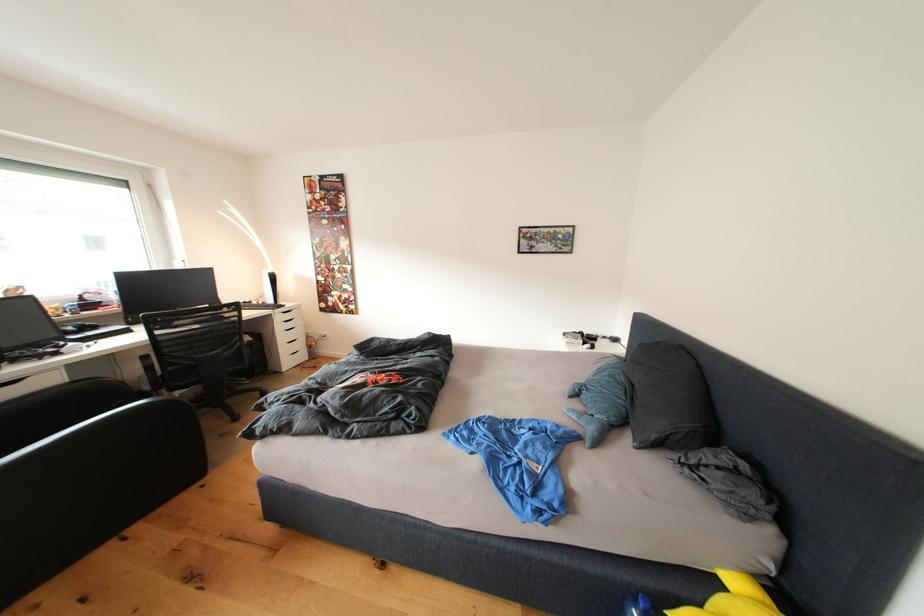
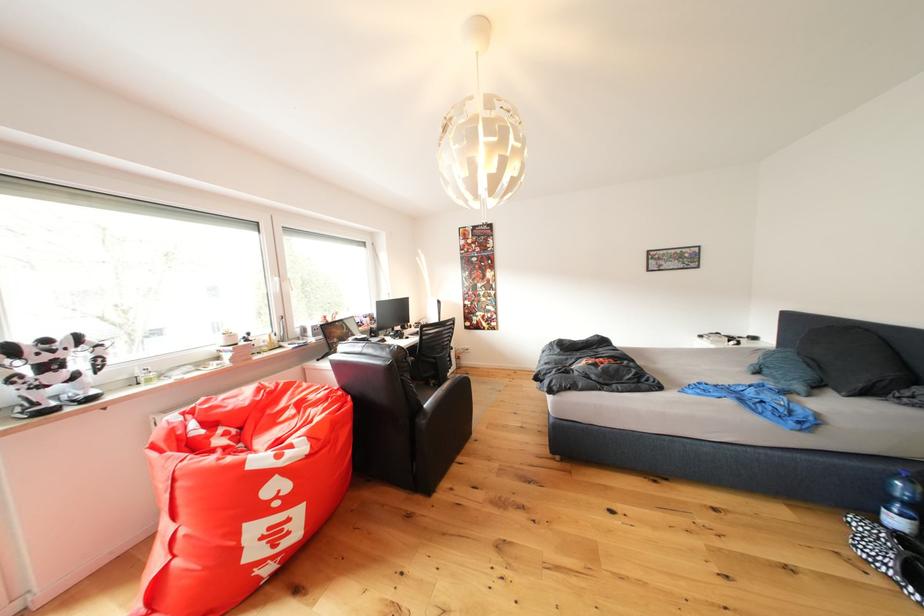
The images are taken continuously from a first-person perspective. In which direction are you moving?

The cameraman walked toward left, backward.